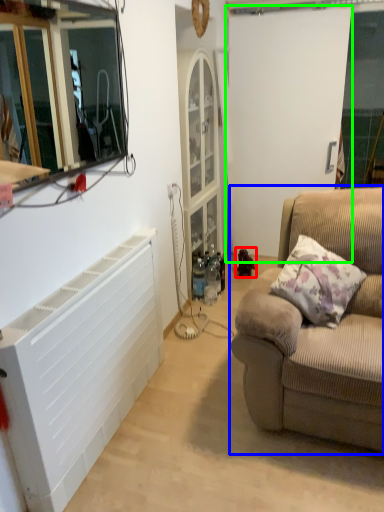
Question: Estimate the real-world distances between objects in this image. Which object is closer to toy (highlighted by a red box), studio couch (highlighted by a blue box) or screen door (highlighted by a green box)?

Choices:
 (A) studio couch
 (B) screen door

Answer: (B)